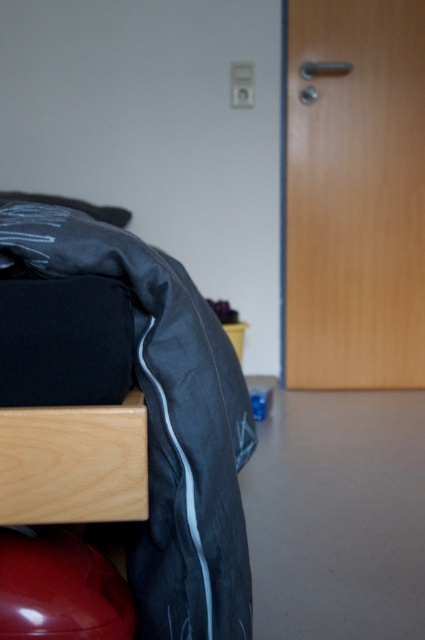
You are moving a small nightstand into the room and want to place it between the matte black bed at lower left and the light wood drawer at lower left. Can you fit it there without blocking the door?

The matte black bed at lower left is further to the viewer than the light wood drawer at lower left, so there is space between them. However, the description does not provide exact measurements of the distance between the two objects or the size of the nightstand, so it is uncertain if it will block the door. Consider checking the available space before placing the nightstand.

You are organizing a small shelf that is 1.2 meters wide. You have two items to place on it. The matte black bed at lower left and the light wood drawer at lower left. Which item should you place on the left side of the shelf to ensure they fit properly?

The matte black bed at lower left is above the light wood drawer at lower left, so the light wood drawer at lower left should be placed on the left side of the shelf to ensure they fit properly.

You are moving a small nightstand that is 15 centimeters wide into the room. You want to place it between the matte black bed at lower left and the light wood drawer at lower left. Is there enough space?

The distance between the matte black bed at lower left and the light wood drawer at lower left is 14.99 centimeters. Since the nightstand is 15 centimeters wide, there is not enough space to place it between them.